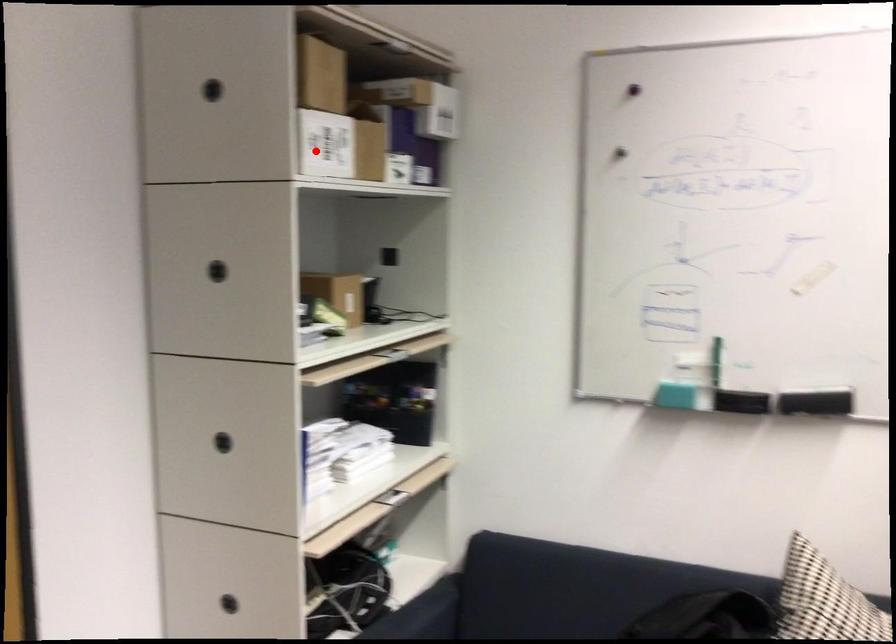
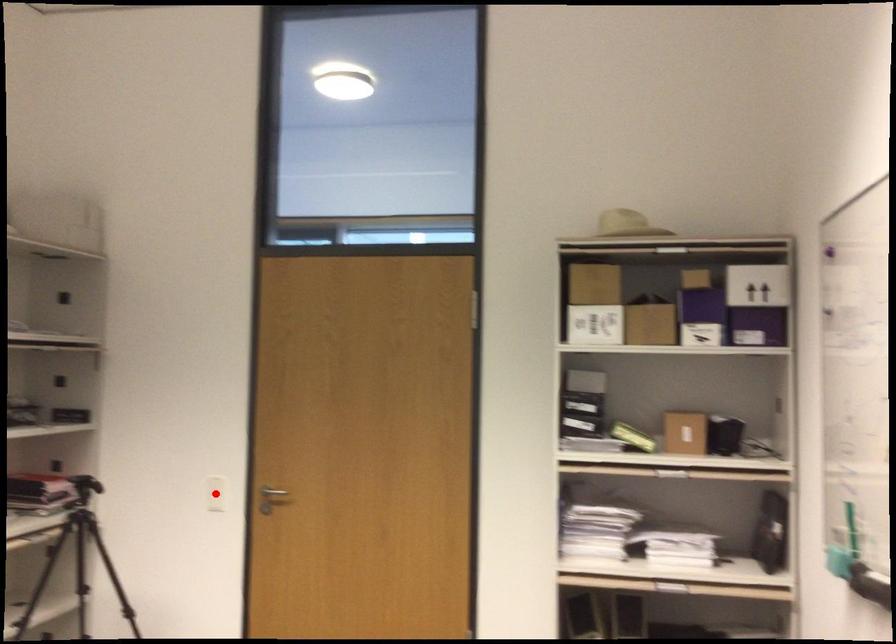
I am providing you with two images of the same scene from different viewpoints. A red point is marked on the first image and another point is marked on the second image. Does the point marked in image1 correspond to the same location as the one in image2?

No